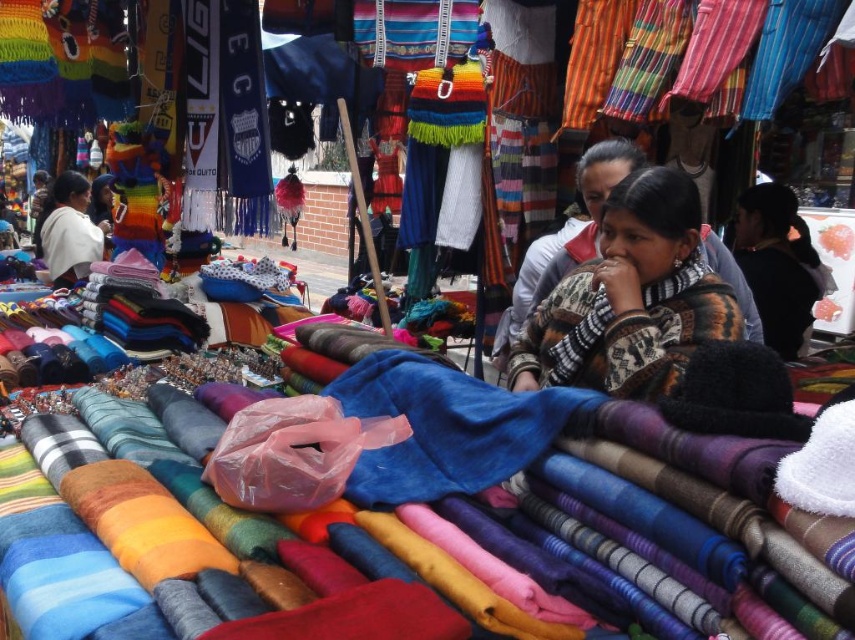
You are a customer in the market and want to pick up both the knitted sweater at center and the white woolen sweater at upper left. If you can carry a maximum distance of 4 meters between the items you pick, can you safely collect both?

The distance between the knitted sweater at center and the white woolen sweater at upper left is 3.79 meters, which is within your 4 meter limit. Yes, you can safely collect both.

You are a customer at the market and want to buy both the knitted sweater at center and the patterned wool scarf at center. The vendor has a small box that can only fit items up to the width of the scarf. Which item will not fit in the box?

The knitted sweater at center will not fit in the box because its width is greater than the patterned wool scarf at center, which is the maximum width allowed by the box.